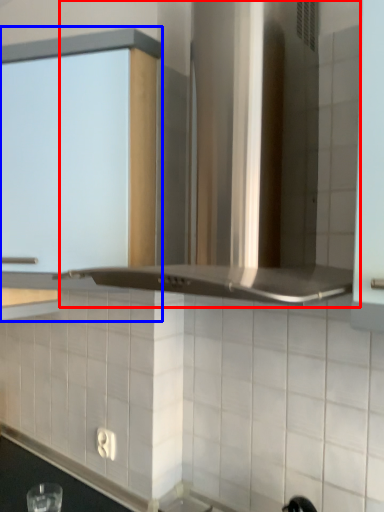
Question: Which point is closer to the camera, vent (highlighted by a red box) or cabinetry (highlighted by a blue box)?

Choices:
 (A) vent
 (B) cabinetry

Answer: (A)